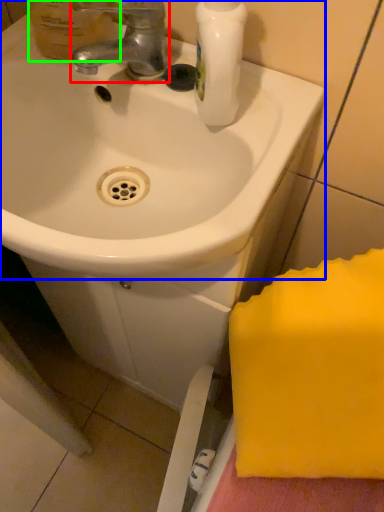
Question: Based on their relative distances, which object is farther from tap (highlighted by a red box)? Choose from sink (highlighted by a blue box) and mouthwash (highlighted by a green box).

Choices:
 (A) sink
 (B) mouthwash

Answer: (A)